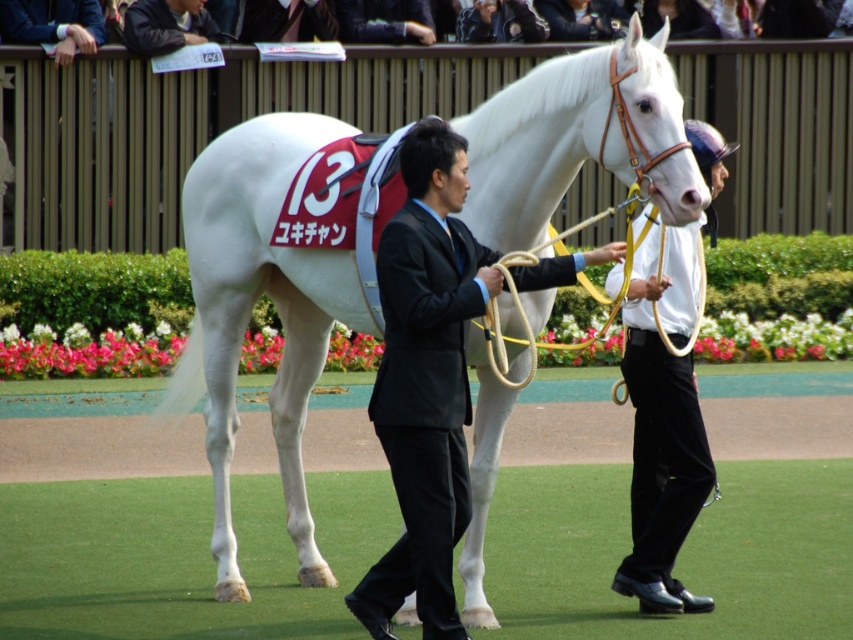
You are a photographer standing at the camera position. You want to capture a closeup shot of the white leather helmet at upper right. Considering the distance, can you take the photo without moving closer?

The white leather helmet at upper right is 8.06 meters away from camera. Since the distance is quite far, you would need a zoom lens or move closer to get a closeup shot.

You are a photographer positioned at the starting line of the horse racing event. You want to capture a photo of the black leather jacket at upper center and the white horse with red saddle cloth at lower right. How far apart are these two objects in the scene?

The black leather jacket at upper center and the white horse with red saddle cloth at lower right are 20.96 meters apart.